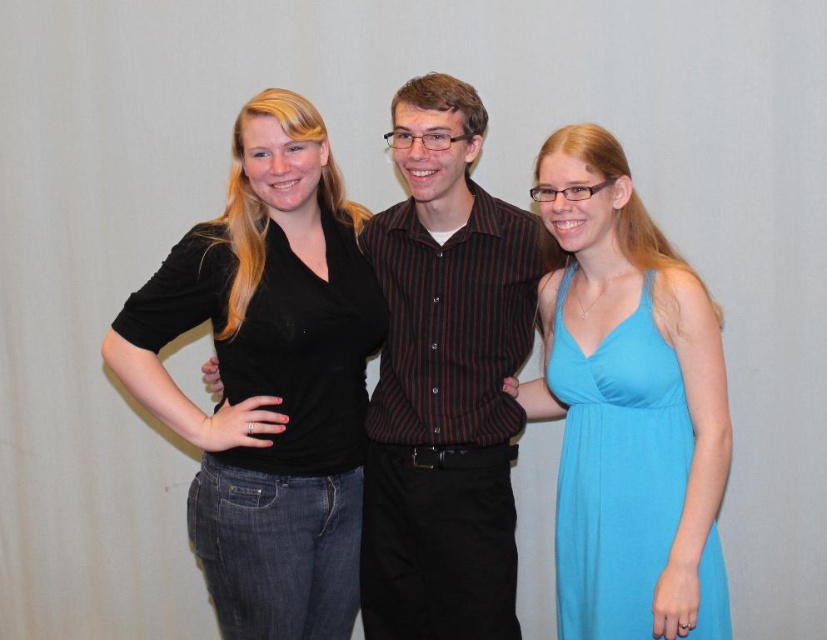
Question: Is black cotton shirt at center above matte blue dress at right?

Choices:
 (A) no
 (B) yes

Answer: (B)

Question: Is the position of black cotton shirt at center more distant than that of striped cotton shirt at center?

Choices:
 (A) no
 (B) yes

Answer: (A)

Question: Based on their relative distances, which object is farther from the matte blue dress at right?

Choices:
 (A) black cotton shirt at center
 (B) striped cotton shirt at center

Answer: (A)

Question: Which of the following is the farthest from the observer?

Choices:
 (A) (570, 598)
 (B) (208, 308)

Answer: (A)

Question: Which object appears closest to the camera in this image?

Choices:
 (A) striped cotton shirt at center
 (B) black cotton shirt at center

Answer: (B)

Question: Is striped cotton shirt at center behind matte blue dress at right?

Choices:
 (A) yes
 (B) no

Answer: (A)